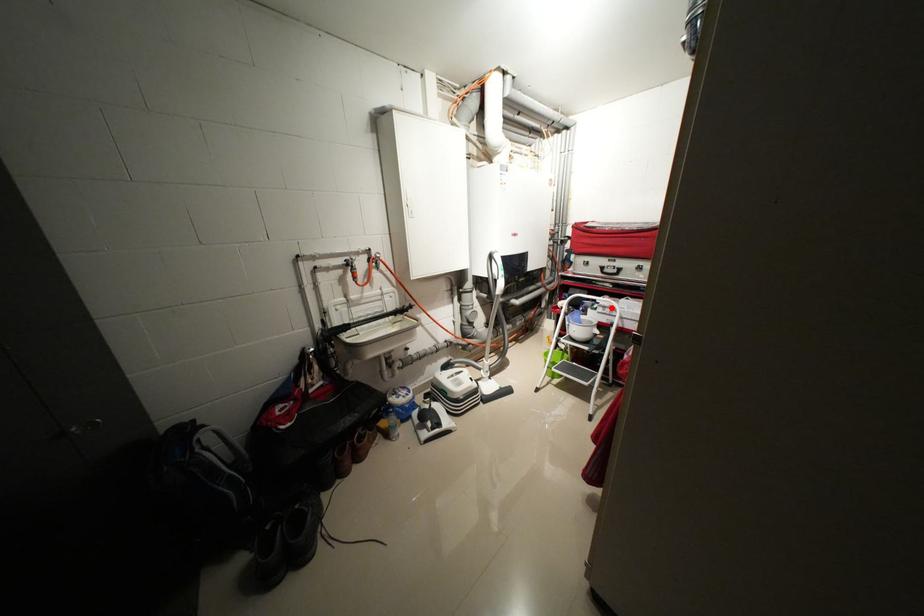
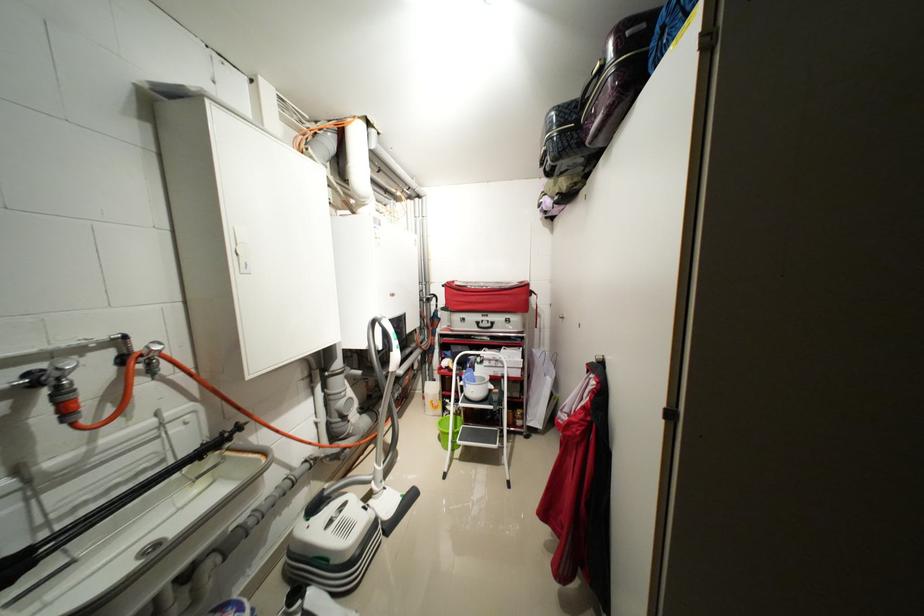
Question: I am providing you with two images of the same scene from different viewpoints. In image1, a red point is highlighted. Considering the same 3D point in image2, which of the following is correct?

Choices:
 (A) It is closer
 (B) It is farther

Answer: (B)